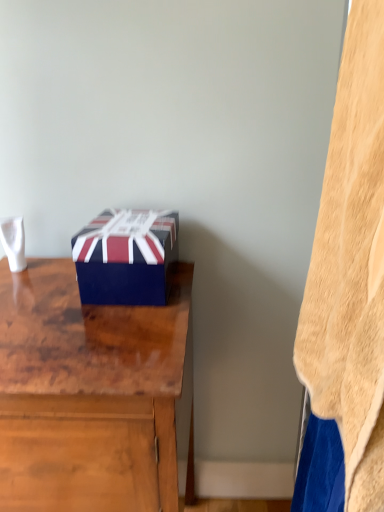
Question: Is wooden desk at center bigger than beige fleece blanket at right?

Choices:
 (A) yes
 (B) no

Answer: (A)

Question: Is wooden desk at center further to the viewer compared to beige fleece blanket at right?

Choices:
 (A) yes
 (B) no

Answer: (A)

Question: From the image's perspective, is wooden desk at center on beige fleece blanket at right?

Choices:
 (A) yes
 (B) no

Answer: (B)

Question: Is wooden desk at center far from beige fleece blanket at right?

Choices:
 (A) no
 (B) yes

Answer: (A)

Question: Is wooden desk at center in front of beige fleece blanket at right?

Choices:
 (A) yes
 (B) no

Answer: (B)

Question: Is wooden desk at center in contact with beige fleece blanket at right?

Choices:
 (A) yes
 (B) no

Answer: (B)

Question: Is beige fleece blanket at right at the right side of blue glossy box at center?

Choices:
 (A) no
 (B) yes

Answer: (B)

Question: From the image's perspective, is beige fleece blanket at right below blue glossy box at center?

Choices:
 (A) no
 (B) yes

Answer: (B)

Question: Would you consider beige fleece blanket at right to be distant from blue glossy box at center?

Choices:
 (A) no
 (B) yes

Answer: (A)

Question: Can you see beige fleece blanket at right touching blue glossy box at center?

Choices:
 (A) yes
 (B) no

Answer: (B)

Question: Is beige fleece blanket at right further to the viewer compared to blue glossy box at center?

Choices:
 (A) no
 (B) yes

Answer: (A)

Question: Is beige fleece blanket at right turned away from blue glossy box at center?

Choices:
 (A) no
 (B) yes

Answer: (A)

Question: Is beige fleece blanket at right in contact with wooden desk at center?

Choices:
 (A) yes
 (B) no

Answer: (B)